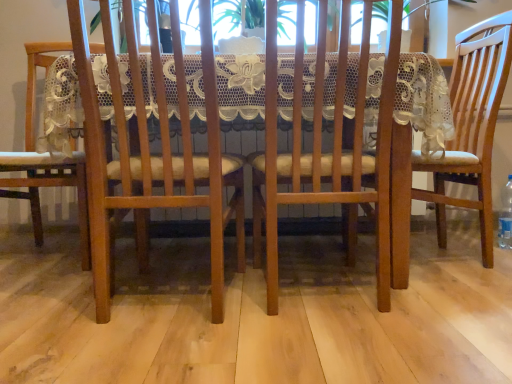
Find the location of a particular element. The height and width of the screenshot is (384, 512). free region under matte wood chair at left, the fourth chair viewed from the right (from a real-world perspective) is located at coordinates (45, 257).